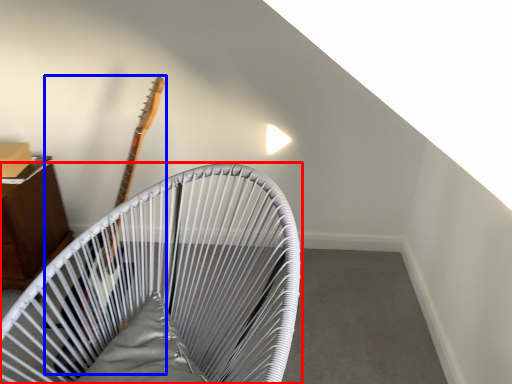
Question: Among these objects, which one is farthest to the camera, furniture (highlighted by a red box) or guitar (highlighted by a blue box)?

Choices:
 (A) furniture
 (B) guitar

Answer: (B)